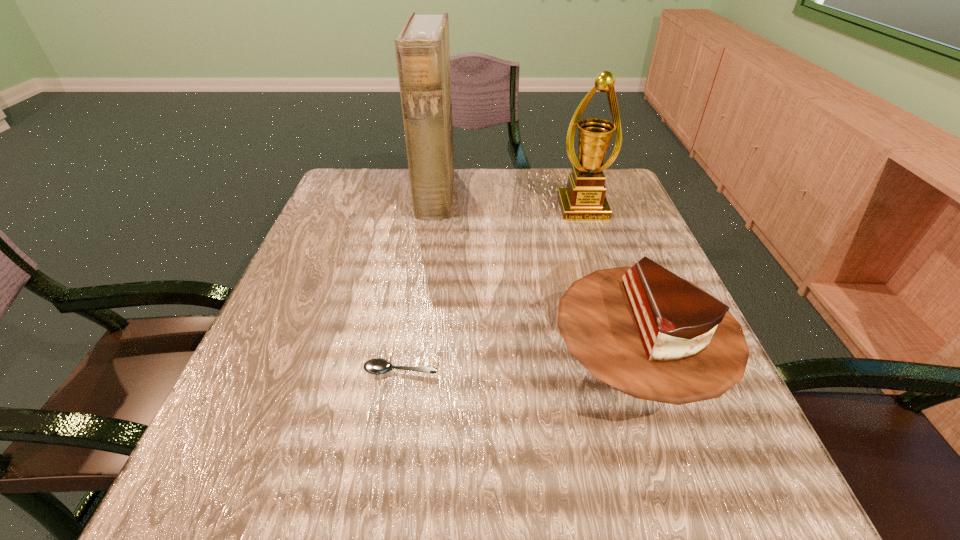
Find the location of `object that is the third closest to the second shortest object`. object that is the third closest to the second shortest object is located at coordinates (422, 48).

In order to click on object that is the third closest to the third tallest object in this screenshot , I will do `click(422, 48)`.

Locate an element on the screen. This screenshot has width=960, height=540. vacant space that satisfies the following two spatial constraints: 1. on the back side of the cake; 2. on the cover of the phonebook is located at coordinates (577, 194).